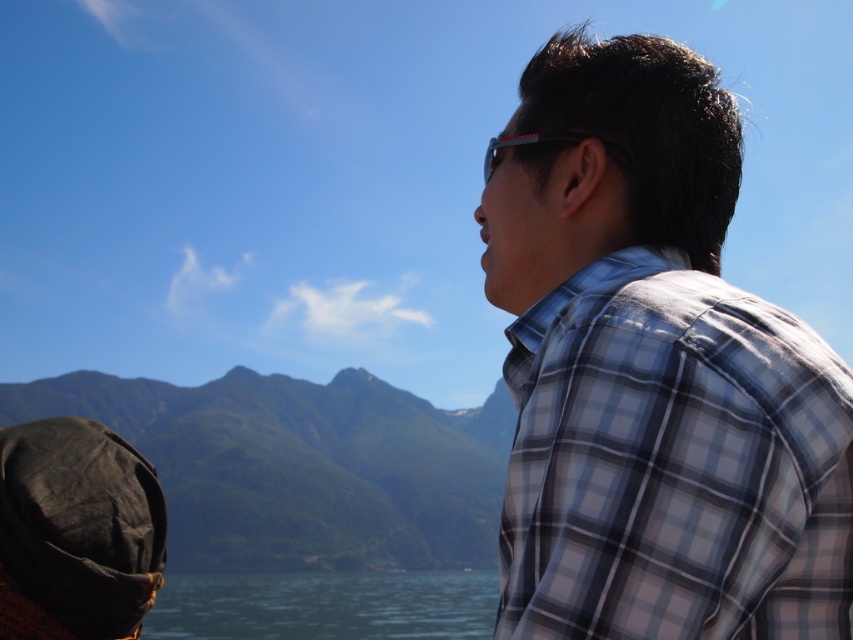
Between plaid fabric shirt at right and matte black goggles at upper center, which one is positioned lower?

plaid fabric shirt at right

Does plaid fabric shirt at right appear under matte black goggles at upper center?

Yes.

Is point (543, 326) closer to viewer compared to point (517, 141)?

Yes, point (543, 326) is closer to viewer.

Find the location of `plaid fabric shirt at right`. plaid fabric shirt at right is located at coordinates (654, 372).

Is point (22, 403) more distant than point (222, 637)?

Yes, it is.

Is point (358, 481) positioned in front of point (326, 580)?

No, (358, 481) is behind (326, 580).

The image size is (853, 640). Identify the location of green matte mountain at left. (293, 468).

Who is taller, blue water at lower center or matte black goggles at upper center?

blue water at lower center is taller.

Which is more to the right, blue water at lower center or matte black goggles at upper center?

matte black goggles at upper center is more to the right.

This screenshot has width=853, height=640. I want to click on blue water at lower center, so click(x=326, y=605).